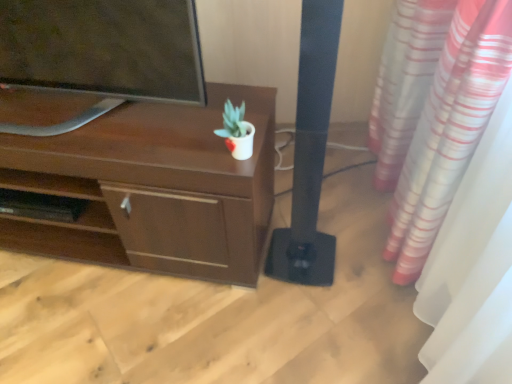
The height and width of the screenshot is (384, 512). I want to click on vacant area that is in front of brown matte desk at upper left, so click(x=103, y=322).